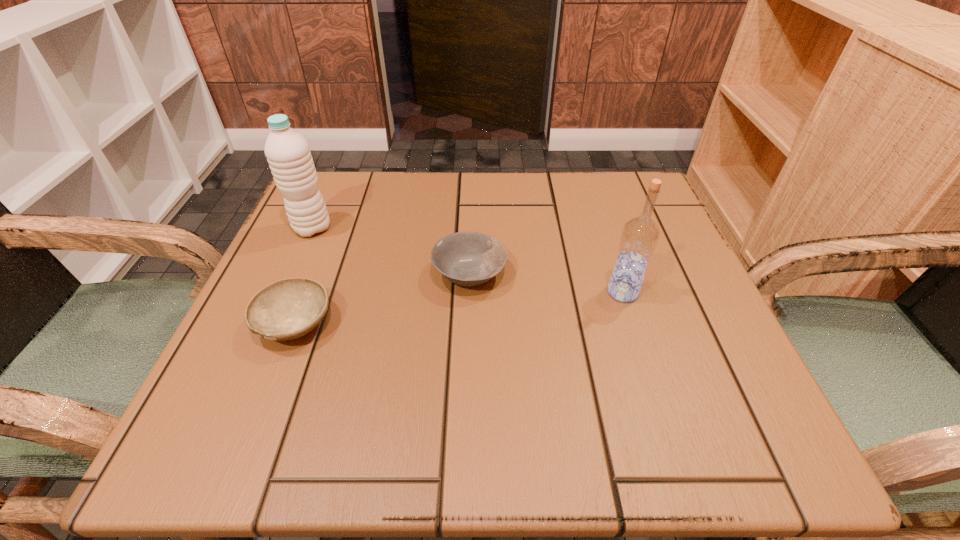
I want to click on vacant area that lies between the water bottle and the right bowl, so click(x=391, y=251).

At what (x,y) coordinates should I click in order to perform the action: click on blank region between the left bowl and the farthest object. Please return your answer as a coordinate pair (x, y). The image size is (960, 540). Looking at the image, I should click on (303, 276).

Find the location of a particular element. The image size is (960, 540). free spot between the vodka and the right bowl is located at coordinates (546, 283).

This screenshot has width=960, height=540. I want to click on free space between the left bowl and the vodka, so click(459, 308).

Where is `vacant space that's between the farthest object and the right bowl`? The image size is (960, 540). vacant space that's between the farthest object and the right bowl is located at coordinates (391, 251).

At what (x,y) coordinates should I click in order to perform the action: click on vacant area that lies between the left bowl and the second object from right to left. Please return your answer as a coordinate pair (x, y). This screenshot has height=540, width=960. Looking at the image, I should click on (382, 299).

Identify the location of free spot between the vodka and the third object from left to right. This screenshot has width=960, height=540. (546, 283).

Locate an element on the screen. vacant area that lies between the water bottle and the left bowl is located at coordinates (303, 276).

Find the location of a particular element. object identified as the third closest to the right bowl is located at coordinates (289, 157).

This screenshot has width=960, height=540. What are the coordinates of `object that stands as the third closest to the right bowl` in the screenshot? It's located at (289, 157).